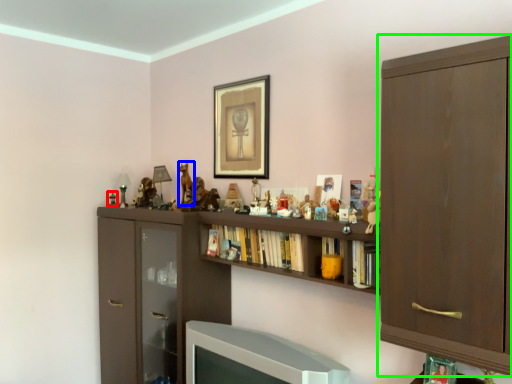
Question: Based on their relative distances, which object is farther from toy (highlighted by a red box)? Choose from animal (highlighted by a blue box) and cabinetry (highlighted by a green box).

Choices:
 (A) animal
 (B) cabinetry

Answer: (B)